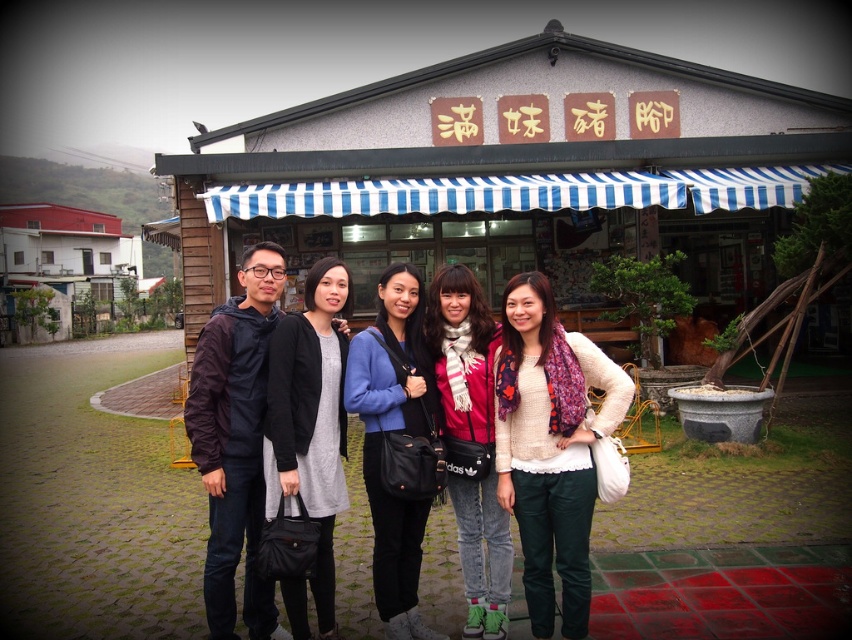
Based on the photo, can you confirm if white knitted sweater at center is positioned to the right of matte black bag at center?

Correct, you'll find white knitted sweater at center to the right of matte black bag at center.

Is white knitted sweater at center thinner than matte black bag at center?

In fact, white knitted sweater at center might be wider than matte black bag at center.

Who is more forward, (591, 353) or (412, 620)?

Positioned in front is point (591, 353).

Where is `white knitted sweater at center`? The height and width of the screenshot is (640, 852). white knitted sweater at center is located at coordinates click(x=550, y=445).

Can you confirm if white knitted sweater at center is positioned above matte gray dress at center?

Actually, white knitted sweater at center is below matte gray dress at center.

Which is behind, point (570, 406) or point (309, 468)?

The point (309, 468) is behind.

Locate an element on the screen. white knitted sweater at center is located at coordinates (550, 445).

Can you confirm if matte black bag at center is positioned to the left of red scarf at center?

Indeed, matte black bag at center is positioned on the left side of red scarf at center.

The height and width of the screenshot is (640, 852). What do you see at coordinates (394, 433) in the screenshot?
I see `matte black bag at center` at bounding box center [394, 433].

Where is `matte black bag at center`? The height and width of the screenshot is (640, 852). matte black bag at center is located at coordinates (394, 433).